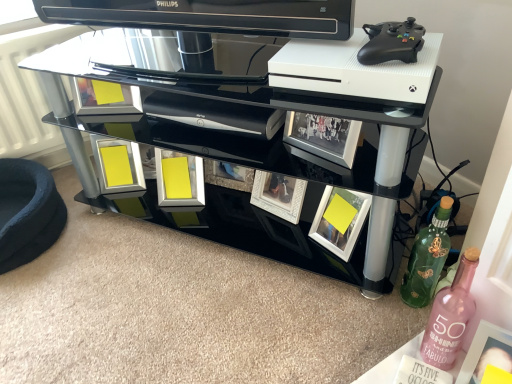
Identify the location of vacant area that is in front of matte yellow picture frame at lower center, acting as the 3th picture frame starting from the right. (163, 244).